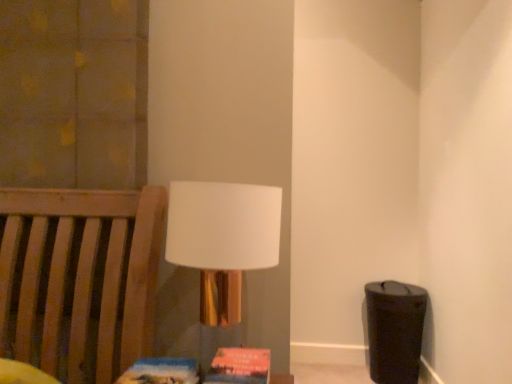
Describe the element at coordinates (223, 239) in the screenshot. I see `gold metallic lampshade at center` at that location.

Where is `gold metallic lampshade at center`? Image resolution: width=512 pixels, height=384 pixels. gold metallic lampshade at center is located at coordinates (223, 239).

Locate an element on the screen. The image size is (512, 384). gold metallic lampshade at center is located at coordinates (223, 239).